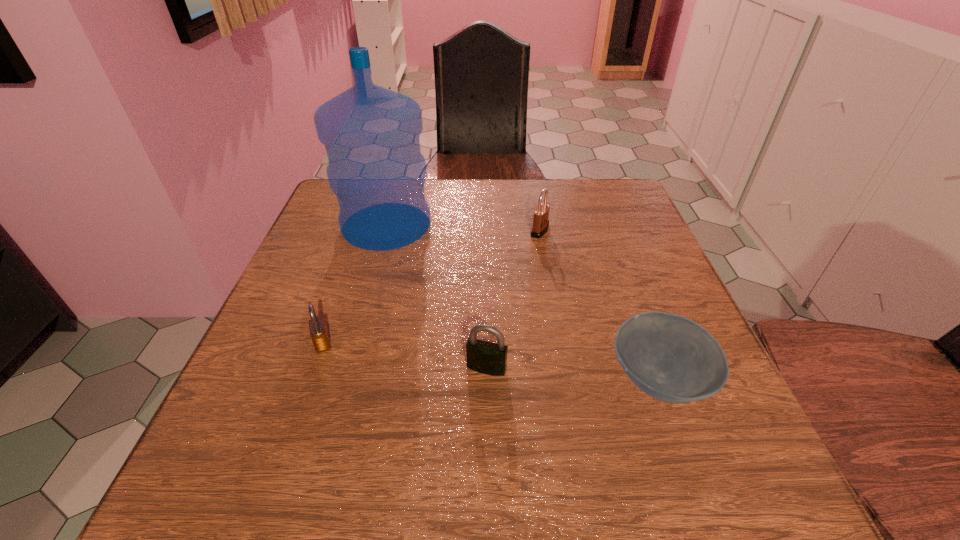
Locate an element on the screen. vacant space that satisfies the following two spatial constraints: 1. on the back side of the third object from right to left; 2. on the left side of the farthest padlock is located at coordinates (485, 231).

This screenshot has width=960, height=540. I want to click on free location that satisfies the following two spatial constraints: 1. on the front side of the nearest padlock; 2. on the left side of the second farthest padlock, so click(314, 368).

The image size is (960, 540). Find the location of `free space that satisfies the following two spatial constraints: 1. on the front side of the shortest object; 2. on the left side of the second object from right to left`. free space that satisfies the following two spatial constraints: 1. on the front side of the shortest object; 2. on the left side of the second object from right to left is located at coordinates (566, 380).

Image resolution: width=960 pixels, height=540 pixels. Find the location of `vacant space that satisfies the following two spatial constraints: 1. on the front side of the second padlock from right to left; 2. on the left side of the shortest object`. vacant space that satisfies the following two spatial constraints: 1. on the front side of the second padlock from right to left; 2. on the left side of the shortest object is located at coordinates (487, 380).